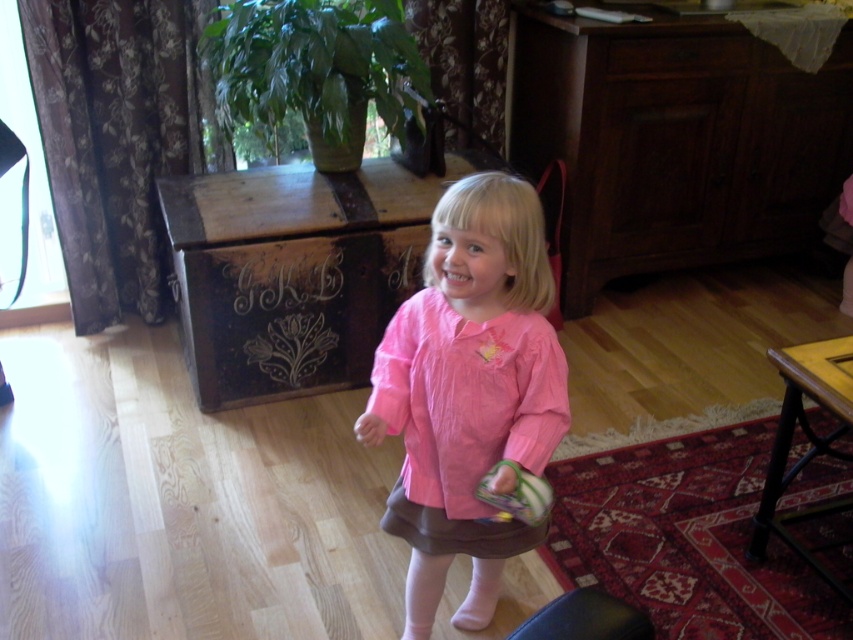
Question: Which of the following is the farthest from the observer?

Choices:
 (A) (515, 490)
 (B) (468, 371)

Answer: (B)

Question: Is pink satin dress at center to the right of plush green toy at lower center from the viewer's perspective?

Choices:
 (A) yes
 (B) no

Answer: (B)

Question: Where is pink satin dress at center located in relation to plush green toy at lower center in the image?

Choices:
 (A) above
 (B) below

Answer: (A)

Question: Which object is closer to the camera taking this photo?

Choices:
 (A) plush green toy at lower center
 (B) pink satin dress at center

Answer: (A)

Question: Which of the following is the farthest from the observer?

Choices:
 (A) plush green toy at lower center
 (B) pink satin dress at center

Answer: (B)

Question: Can you confirm if pink satin dress at center is bigger than plush green toy at lower center?

Choices:
 (A) yes
 (B) no

Answer: (A)